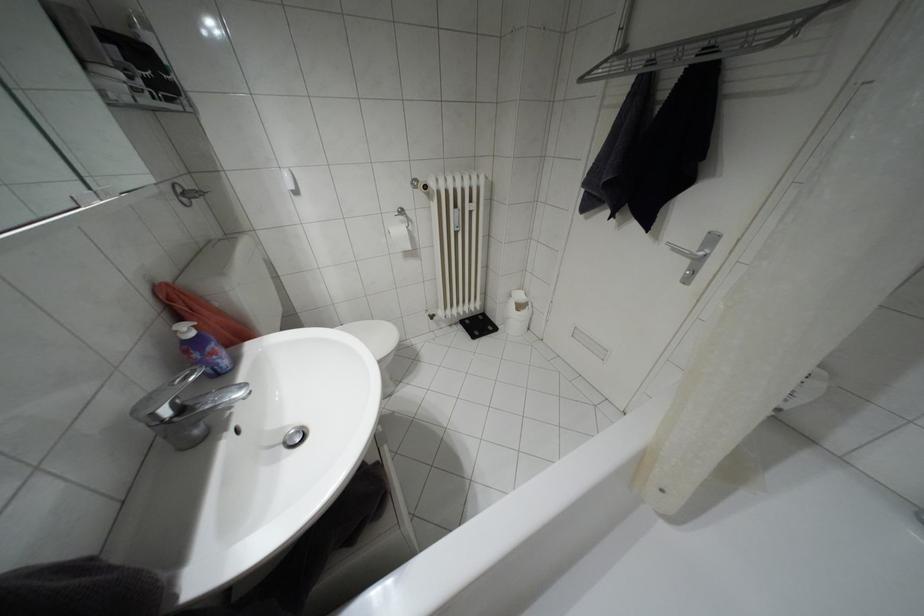
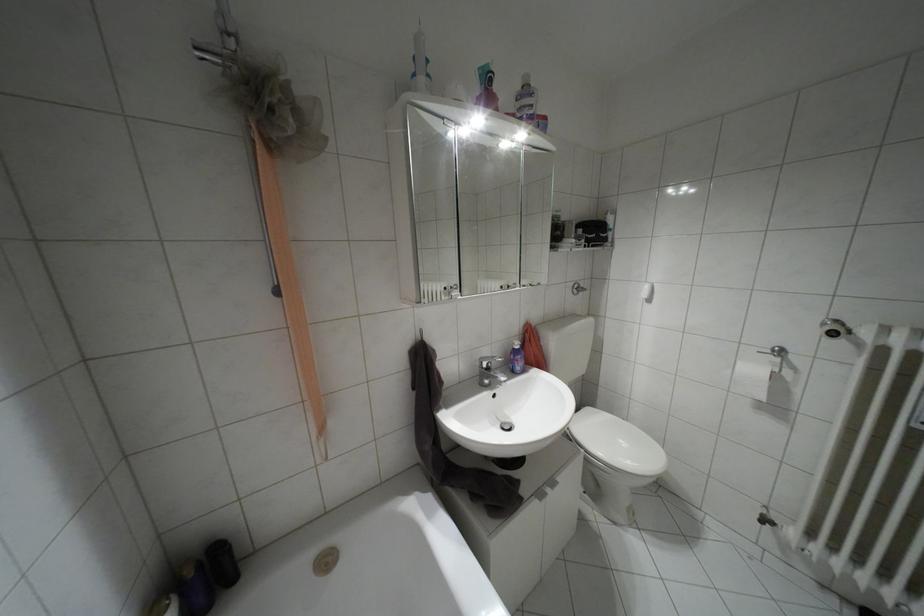
Question: Based on the continuous images, in which direction is the camera rotating? Reply with the corresponding letter.

Choices:
 (A) Left
 (B) Right
 (C) Up
 (D) Down

Answer: (A)